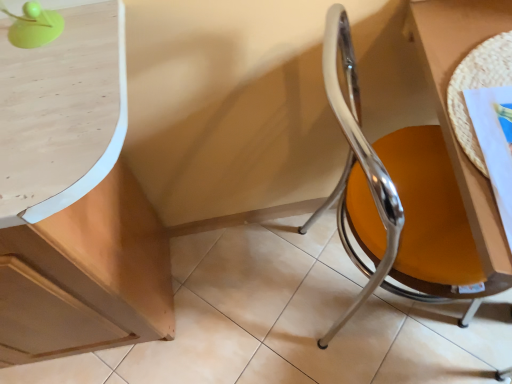
Question: Can green plastic ball at upper left be found inside chrome/yellow seat at right?

Choices:
 (A) yes
 (B) no

Answer: (B)

Question: Does chrome/yellow seat at right come behind green plastic ball at upper left?

Choices:
 (A) yes
 (B) no

Answer: (A)

Question: From the image's perspective, is chrome/yellow seat at right above green plastic ball at upper left?

Choices:
 (A) no
 (B) yes

Answer: (A)

Question: From a real-world perspective, is chrome/yellow seat at right positioned over green plastic ball at upper left based on gravity?

Choices:
 (A) yes
 (B) no

Answer: (B)

Question: Is chrome/yellow seat at right closer to the viewer compared to green plastic ball at upper left?

Choices:
 (A) no
 (B) yes

Answer: (A)

Question: Considering the positions of light brown wood cabinet at left and chrome/yellow seat at right in the image, is light brown wood cabinet at left taller or shorter than chrome/yellow seat at right?

Choices:
 (A) short
 (B) tall

Answer: (B)

Question: Is light brown wood cabinet at left bigger or smaller than chrome/yellow seat at right?

Choices:
 (A) big
 (B) small

Answer: (A)

Question: In the image, is light brown wood cabinet at left positioned in front of or behind chrome/yellow seat at right?

Choices:
 (A) front
 (B) behind

Answer: (B)

Question: Considering the positions of point (74, 326) and point (386, 175), is point (74, 326) closer or farther from the camera than point (386, 175)?

Choices:
 (A) farther
 (B) closer

Answer: (A)

Question: Considering the positions of woven mat at right and chrome/yellow seat at right in the image, is woven mat at right bigger or smaller than chrome/yellow seat at right?

Choices:
 (A) small
 (B) big

Answer: (A)

Question: In terms of height, does woven mat at right look taller or shorter compared to chrome/yellow seat at right?

Choices:
 (A) tall
 (B) short

Answer: (B)

Question: Relative to chrome/yellow seat at right, is woven mat at right in front or behind?

Choices:
 (A) behind
 (B) front

Answer: (A)

Question: Considering the positions of woven mat at right and chrome/yellow seat at right in the image, is woven mat at right wider or thinner than chrome/yellow seat at right?

Choices:
 (A) wide
 (B) thin

Answer: (A)

Question: Looking at their shapes, would you say green plastic ball at upper left is wider or thinner than woven mat at right?

Choices:
 (A) thin
 (B) wide

Answer: (A)

Question: Is point (30, 36) positioned closer to the camera than point (482, 241)?

Choices:
 (A) closer
 (B) farther

Answer: (A)